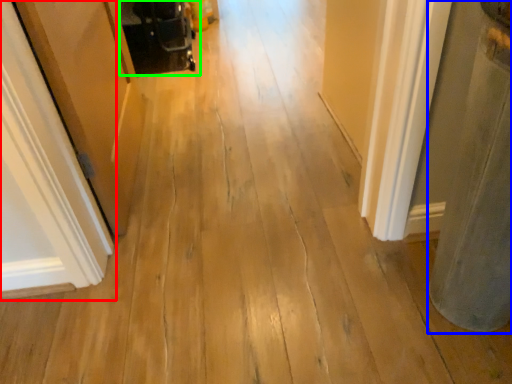
Question: Based on their relative distances, which object is farther from door (highlighted by a red box)? Choose from pillar (highlighted by a blue box) and baby carriage (highlighted by a green box).

Choices:
 (A) pillar
 (B) baby carriage

Answer: (B)